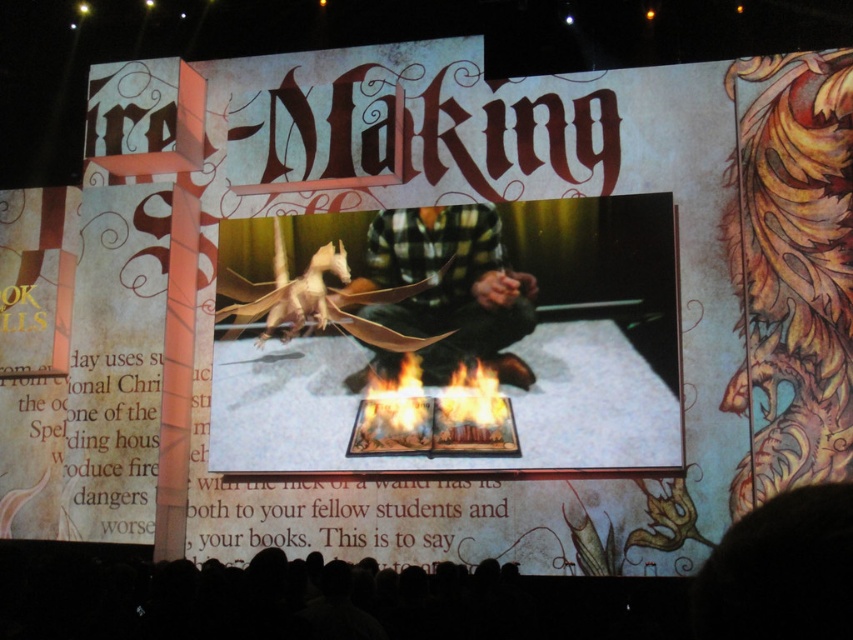
Question: Does paper dragon at center appear under green plaid shirt at center?

Choices:
 (A) no
 (B) yes

Answer: (B)

Question: Which of the following is the farthest from the observer?

Choices:
 (A) green plaid shirt at center
 (B) flametransparentbook at center

Answer: (B)

Question: Does green plaid shirt at center appear under flametransparentbook at center?

Choices:
 (A) no
 (B) yes

Answer: (A)

Question: Which object is the closest to the flametransparentbook at center?

Choices:
 (A) green plaid shirt at center
 (B) paper dragon at center

Answer: (A)

Question: Which of the following is the closest to the observer?

Choices:
 (A) [x=434, y=358]
 (B) [x=392, y=428]

Answer: (B)

Question: Does paper dragon at center have a lesser width compared to green plaid shirt at center?

Choices:
 (A) yes
 (B) no

Answer: (B)